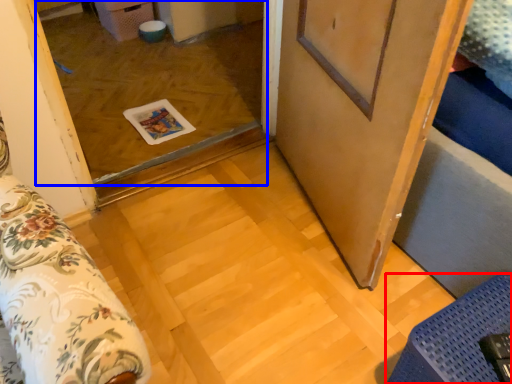
Question: Which object appears closest to the camera in this image, furniture (highlighted by a red box) or window (highlighted by a blue box)?

Choices:
 (A) furniture
 (B) window

Answer: (A)